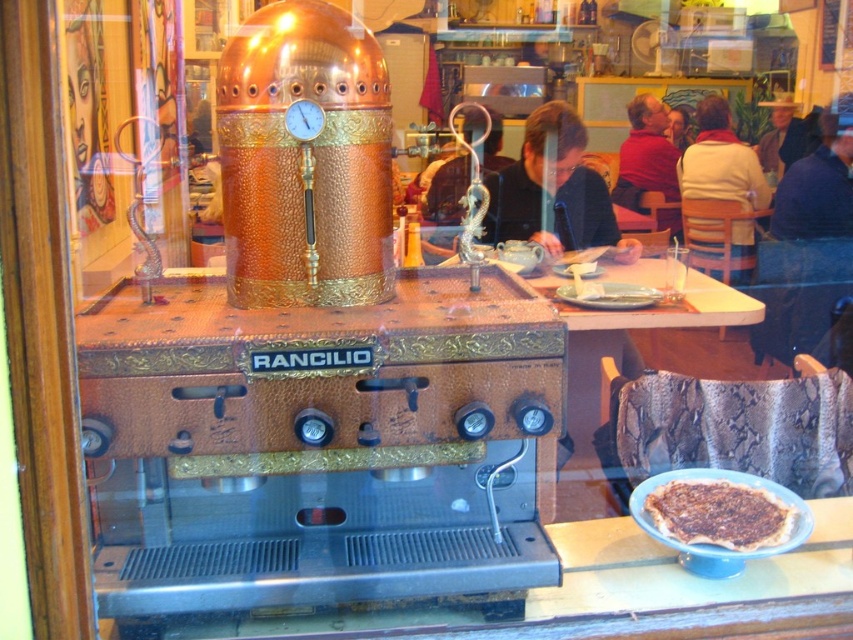
Based on the photo, can you confirm if dark brown crusty pizza at lower right is bigger than silver metallic dragon at center?

Incorrect, dark brown crusty pizza at lower right is not larger than silver metallic dragon at center.

This screenshot has width=853, height=640. What do you see at coordinates (720, 513) in the screenshot?
I see `dark brown crusty pizza at lower right` at bounding box center [720, 513].

At what (x,y) coordinates should I click in order to perform the action: click on dark brown crusty pizza at lower right. Please return your answer as a coordinate pair (x, y). Looking at the image, I should click on (720, 513).

Based on the photo, who is positioned more to the right, matte black shirt at center or light brown wooden chair at upper right?

From the viewer's perspective, light brown wooden chair at upper right appears more on the right side.

Between point (561, 134) and point (706, 113), which one is positioned in front?

Point (561, 134) is more forward.

Where is `matte black shirt at center`? This screenshot has width=853, height=640. matte black shirt at center is located at coordinates (553, 192).

Is light brown wooden chair at upper right above blue fabric jacket at upper right?

Actually, light brown wooden chair at upper right is below blue fabric jacket at upper right.

Between light brown wooden chair at upper right and blue fabric jacket at upper right, which one is positioned lower?

light brown wooden chair at upper right is below.

Where is `light brown wooden chair at upper right`? This screenshot has height=640, width=853. light brown wooden chair at upper right is located at coordinates (721, 161).